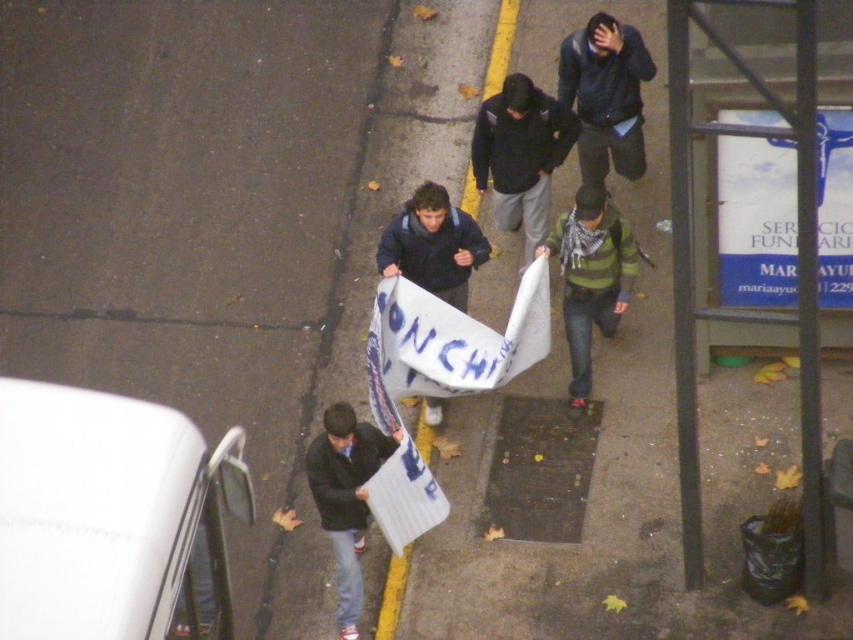
Is dark blue jacket at upper center above dark blue jacket at center?

Yes, dark blue jacket at upper center is above dark blue jacket at center.

Does dark blue jacket at upper center come in front of dark blue jacket at center?

No.

Who is more distant from viewer, (582, 177) or (339, 461)?

Positioned behind is point (582, 177).

Identify the location of dark blue jacket at upper center. This screenshot has height=640, width=853. (605, 96).

Is dark gray hoodie at center taller than dark blue jacket at center?

No.

You are a GUI agent. You are given a task and a screenshot of the screen. Output one action in this format:
    pyautogui.click(x=<x>, y=<y>)
    Task: Click on the dark gray hoodie at center
    Image resolution: width=853 pixels, height=640 pixels.
    Given the screenshot: What is the action you would take?
    pyautogui.click(x=520, y=154)

This screenshot has height=640, width=853. What are the coordinates of `dark gray hoodie at center` in the screenshot? It's located at (520, 154).

Between dark blue jacket at upper center and green striped sweater at center, which one appears on the left side from the viewer's perspective?

From the viewer's perspective, green striped sweater at center appears more on the left side.

Can you confirm if dark blue jacket at upper center is positioned above green striped sweater at center?

Correct, dark blue jacket at upper center is located above green striped sweater at center.

This screenshot has height=640, width=853. Describe the element at coordinates (605, 96) in the screenshot. I see `dark blue jacket at upper center` at that location.

Locate an element on the screen. This screenshot has height=640, width=853. dark blue jacket at upper center is located at coordinates (605, 96).